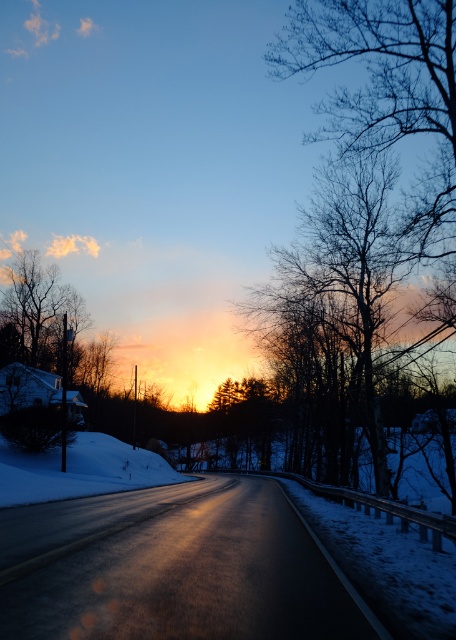
Question: Which point is closer to the camera?

Choices:
 (A) (21, 292)
 (B) (86, 444)

Answer: (B)

Question: Does white powdery snow at lower left lie behind silhouette bare tree at upper left?

Choices:
 (A) no
 (B) yes

Answer: (A)

Question: Which of the following is the farthest from the observer?

Choices:
 (A) (398, 227)
 (B) (74, 316)
 (C) (181, 476)

Answer: (B)

Question: Which object appears farthest from the camera in this image?

Choices:
 (A) white powdery snow at lower left
 (B) silhouette bare tree at upper left

Answer: (B)

Question: In this image, where is white powdery snow at lower left located relative to silhouette bare tree at upper left?

Choices:
 (A) above
 (B) below

Answer: (B)

Question: Is bare branches at center smaller than white powdery snow at lower left?

Choices:
 (A) no
 (B) yes

Answer: (A)